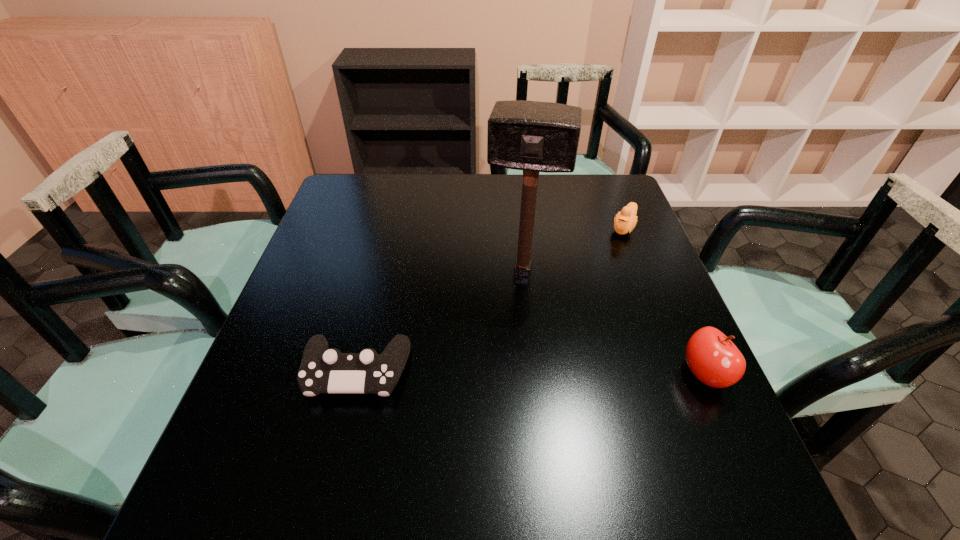
Identify the location of vacant space that satisfies the following two spatial constraints: 1. on the surface of the second tallest object; 2. on the stem of the control. The height and width of the screenshot is (540, 960). (356, 374).